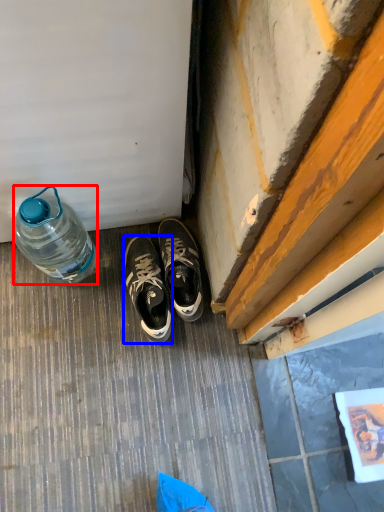
Question: Which of the following is the closest to the observer, bottle (highlighted by a red box) or sneakers (highlighted by a blue box)?

Choices:
 (A) bottle
 (B) sneakers

Answer: (A)